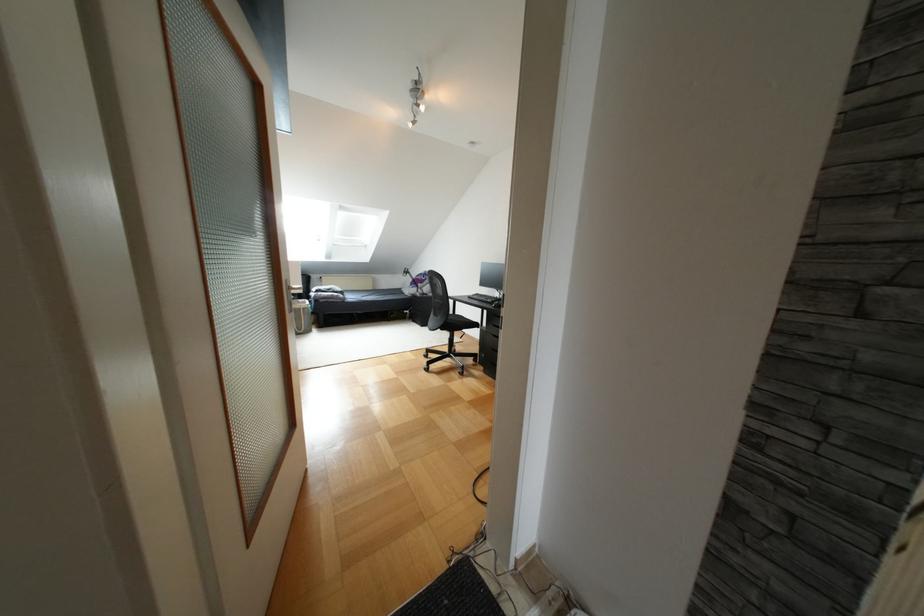
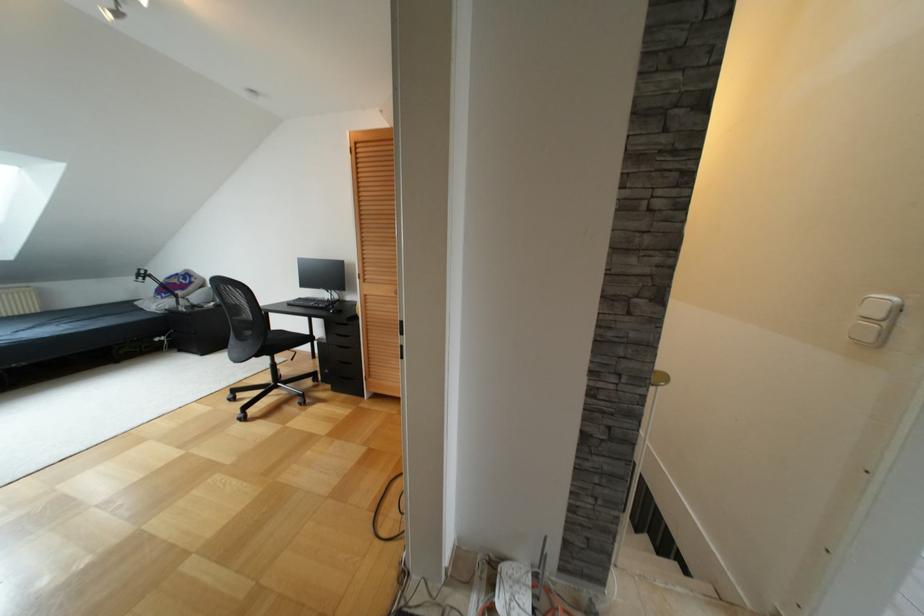
Question: The first image is from the beginning of the video and the second image is from the end. How did the camera likely rotate when shooting the video?

Choices:
 (A) Left
 (B) Right
 (C) Up
 (D) Down

Answer: (B)